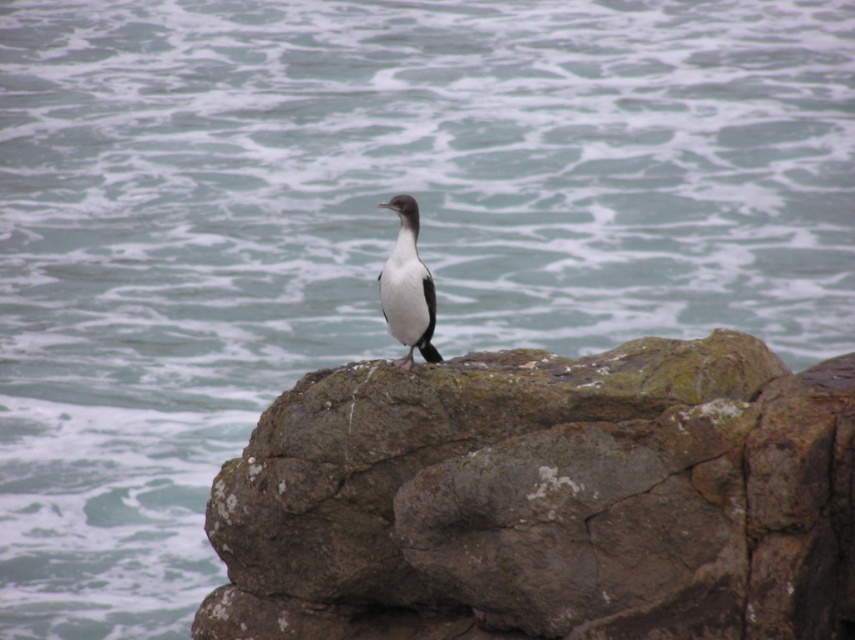
You are standing in front of the bird and want to place a small marker at each of the two points, point (x=364, y=592) and point (x=423, y=330). Which point should you place the marker closer to the bird?

Point (x=364, y=592) is closer to the bird because it is further to the viewer than point (x=423, y=330).

You are a photographer aiming to capture the white glossy bird at center and the rough textured rock at center in a single shot. Based on their positions, which object should you adjust your camera focus on first to ensure both are in frame?

The rough textured rock at center is positioned on the right side of white glossy bird at center. To ensure both are in frame, focus on the white glossy bird at center first, then adjust to include the rock on its right side.